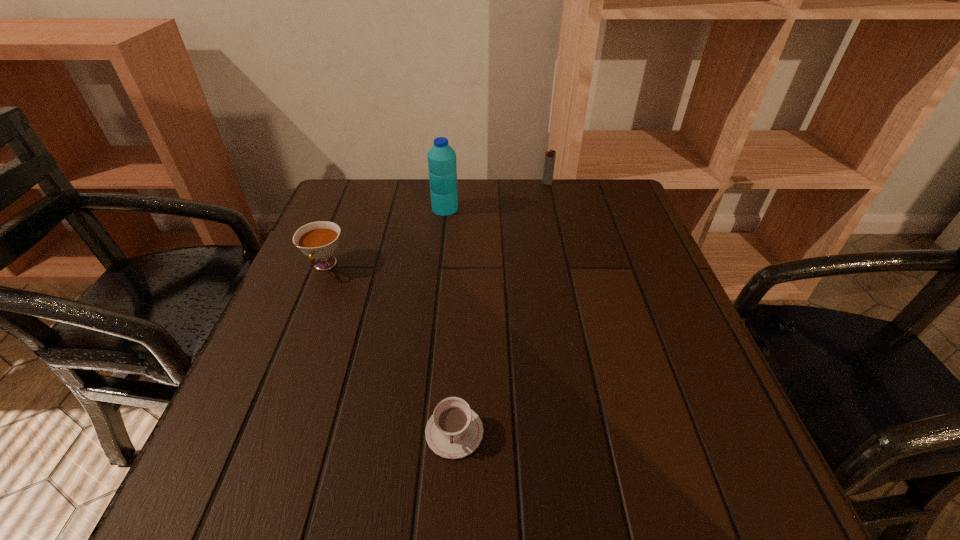
Locate an element on the screen. vacant space at the far right corner of the desktop is located at coordinates (583, 210).

Where is `blank space at the near right corner`? The height and width of the screenshot is (540, 960). blank space at the near right corner is located at coordinates (684, 485).

The width and height of the screenshot is (960, 540). Find the location of `vacant space in between the nearest object and the leftmost object`. vacant space in between the nearest object and the leftmost object is located at coordinates (390, 349).

The width and height of the screenshot is (960, 540). Find the location of `blank region between the tallest object and the third shortest object`. blank region between the tallest object and the third shortest object is located at coordinates (496, 196).

The width and height of the screenshot is (960, 540). I want to click on unoccupied position between the right teacup and the farther teacup, so click(390, 349).

The height and width of the screenshot is (540, 960). I want to click on empty space between the third farthest object and the shortest object, so [390, 349].

In order to click on free point between the tallest object and the right teacup in this screenshot , I will do `click(449, 320)`.

You are a GUI agent. You are given a task and a screenshot of the screen. Output one action in this format:
    pyautogui.click(x=<x>, y=<y>)
    Task: Click on the vacant area that lies between the leftmost object and the rightmost object
    This screenshot has width=960, height=540.
    Given the screenshot: What is the action you would take?
    pyautogui.click(x=436, y=225)

The height and width of the screenshot is (540, 960). Find the location of `vacant space that is in between the third tallest object and the second farthest object`. vacant space that is in between the third tallest object and the second farthest object is located at coordinates (385, 237).

Locate an element on the screen. This screenshot has width=960, height=540. free space that is in between the right teacup and the water bottle is located at coordinates (449, 320).